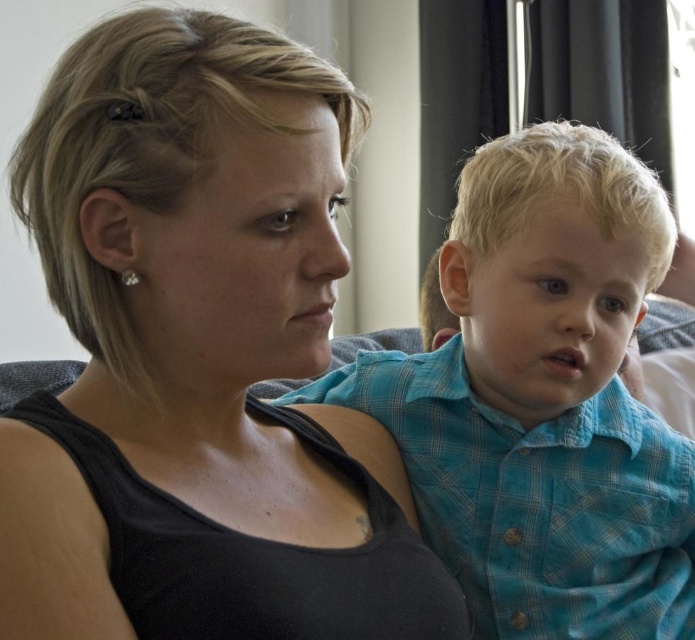
Measure the distance between black matte tank top at center and camera.

black matte tank top at center is 18.78 inches away from camera.

Image resolution: width=695 pixels, height=640 pixels. I want to click on black matte tank top at center, so click(x=199, y=356).

The height and width of the screenshot is (640, 695). What are the coordinates of `black matte tank top at center` in the screenshot? It's located at (199, 356).